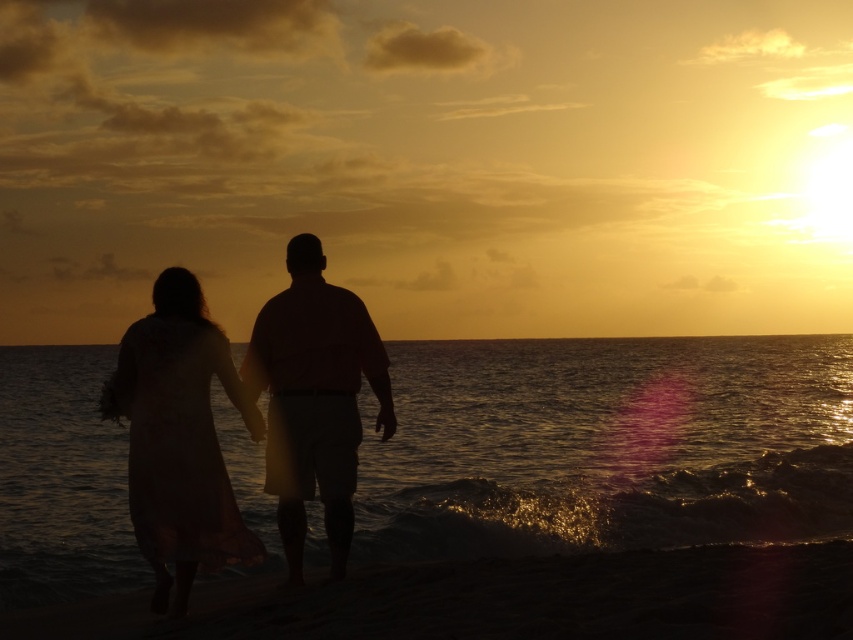
You are a photographer trying to capture the sunset scene. You notice the silky white dress at lower left and the matte pink shirt at center. Which clothing item appears shorter in the photo?

The silky white dress at lower left appears shorter than the matte pink shirt at center in the photo.

You are a photographer standing at the edge of the beach. You want to capture a closeup shot of the matte pink shirt at center without the glistening water at lower center appearing in the frame. Given that your camera has a focal length of 50mm, can you determine if this is possible based on their distance apart?

The distance between the glistening water at lower center and the matte pink shirt at center is 21.00 meters. With a 50mm focal length, the photographer can likely achieve a closeup of the matte pink shirt at center without including the glistening water at lower center, as the separation allows for selective framing.